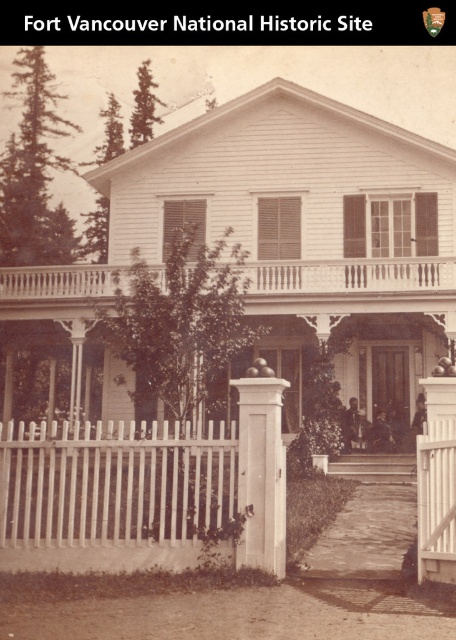
Is point (431, 259) farther from camera compared to point (245, 424)?

Yes, point (431, 259) is behind point (245, 424).

Is point (36, 291) closer to camera compared to point (258, 484)?

No, (36, 291) is behind (258, 484).

Find the location of a particular element. Image resolution: width=456 pixels, height=640 pixels. white wooden porch at center is located at coordinates (353, 276).